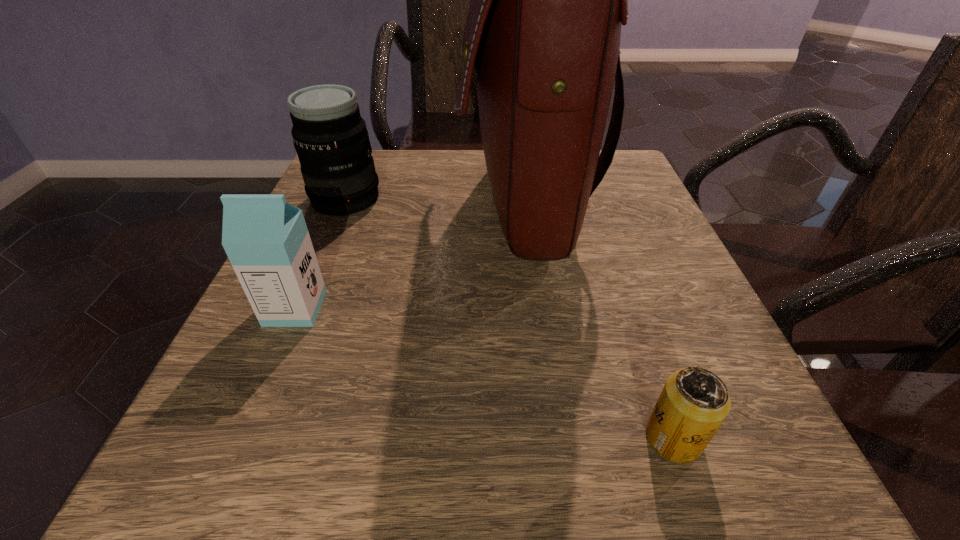
Locate an element on the screen. vacant space located on the back of the shortest object is located at coordinates (654, 380).

Where is `satchel that is positioned at the far edge`? Image resolution: width=960 pixels, height=540 pixels. satchel that is positioned at the far edge is located at coordinates (543, 29).

Locate an element on the screen. This screenshot has width=960, height=540. telephoto lens located in the far edge section of the desktop is located at coordinates (330, 137).

Locate an element on the screen. object present at the near edge is located at coordinates (694, 402).

The width and height of the screenshot is (960, 540). What are the coordinates of `telephoto lens that is at the left edge` in the screenshot? It's located at (330, 137).

Where is `milk carton present at the left edge`? The image size is (960, 540). milk carton present at the left edge is located at coordinates (266, 239).

Where is `satchel at the right edge`? satchel at the right edge is located at coordinates (543, 29).

Find the location of a particular element. The image size is (960, 540). beer can that is at the right edge is located at coordinates (694, 402).

In order to click on object that is at the far left corner in this screenshot , I will do `click(330, 137)`.

The width and height of the screenshot is (960, 540). What are the coordinates of `object at the far right corner` in the screenshot? It's located at (543, 29).